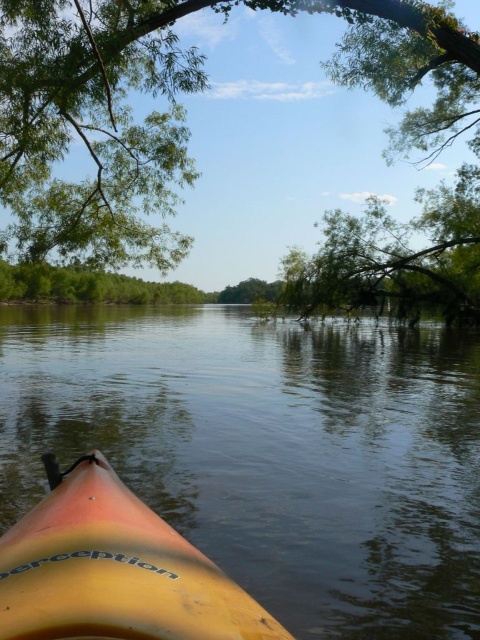
Question: Where is yellow plastic kayak at lower left located in relation to green leafy tree at upper center in the image?

Choices:
 (A) below
 (B) above

Answer: (A)

Question: Among these points, which one is farthest from the camera?

Choices:
 (A) (466, 60)
 (B) (370, 572)

Answer: (A)

Question: Which point appears farthest from the camera in this image?

Choices:
 (A) (25, 124)
 (B) (289, 352)
 (C) (88, 636)

Answer: (B)

Question: Does yellow plastic kayak at lower left appear on the left side of green leafy tree at upper center?

Choices:
 (A) yes
 (B) no

Answer: (A)

Question: Does yellow plastic kayak at lower left appear under green leafy tree at upper center?

Choices:
 (A) yes
 (B) no

Answer: (A)

Question: Among these points, which one is farthest from the camera?

Choices:
 (A) click(x=370, y=28)
 (B) click(x=72, y=564)

Answer: (A)